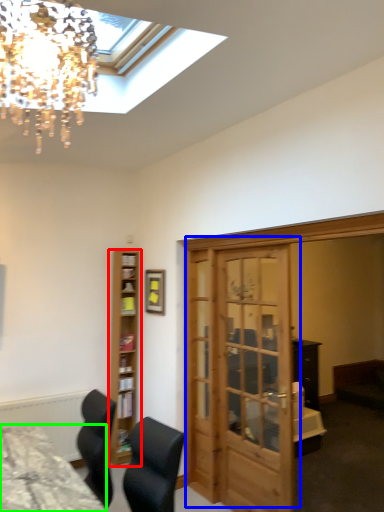
Question: Which object is positioned closest to shelf (highlighted by a red box)? Select from door (highlighted by a blue box) and desk (highlighted by a green box).

Choices:
 (A) door
 (B) desk

Answer: (A)